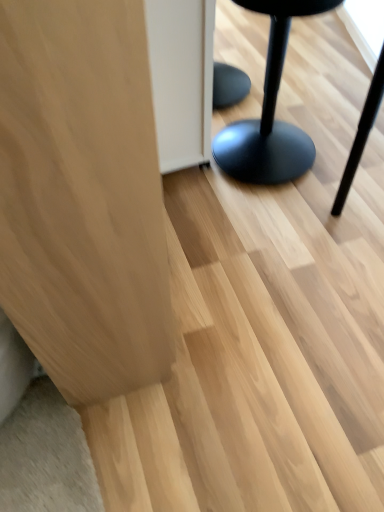
Question: Can you confirm if light wood cabinet at left, positioned as the second furniture in right-to-left order, is wider than matte black stool at right, the 2th furniture when ordered from left to right?

Choices:
 (A) yes
 (B) no

Answer: (A)

Question: Is light wood cabinet at left, positioned as the second furniture in right-to-left order, located outside matte black stool at right, the 2th furniture when ordered from left to right?

Choices:
 (A) yes
 (B) no

Answer: (A)

Question: Is light wood cabinet at left, positioned as the second furniture in right-to-left order, at the right side of matte black stool at right, placed as the first furniture when sorted from right to left?

Choices:
 (A) no
 (B) yes

Answer: (A)

Question: Can you confirm if light wood cabinet at left, the 1th furniture from the left, is bigger than matte black stool at right, placed as the first furniture when sorted from right to left?

Choices:
 (A) no
 (B) yes

Answer: (B)

Question: Are light wood cabinet at left, positioned as the second furniture in right-to-left order, and matte black stool at right, the 2th furniture when ordered from left to right, far apart?

Choices:
 (A) yes
 (B) no

Answer: (A)

Question: Does light wood cabinet at left, the 1th furniture from the left, appear on the left side of matte black stool at right, placed as the first furniture when sorted from right to left?

Choices:
 (A) no
 (B) yes

Answer: (B)

Question: Can you confirm if matte black stool at right, placed as the first furniture when sorted from right to left, is positioned to the right of light wood cabinet at left, positioned as the second furniture in right-to-left order?

Choices:
 (A) yes
 (B) no

Answer: (A)

Question: Would you consider matte black stool at right, the 2th furniture when ordered from left to right, to be distant from light wood cabinet at left, positioned as the second furniture in right-to-left order?

Choices:
 (A) no
 (B) yes

Answer: (B)

Question: Does matte black stool at right, the 2th furniture when ordered from left to right, have a greater width compared to light wood cabinet at left, positioned as the second furniture in right-to-left order?

Choices:
 (A) no
 (B) yes

Answer: (A)

Question: From the image's perspective, is matte black stool at right, placed as the first furniture when sorted from right to left, under light wood cabinet at left, the 1th furniture from the left?

Choices:
 (A) no
 (B) yes

Answer: (A)

Question: Is matte black stool at right, the 2th furniture when ordered from left to right, oriented away from light wood cabinet at left, positioned as the second furniture in right-to-left order?

Choices:
 (A) yes
 (B) no

Answer: (B)

Question: From the image's perspective, is matte black stool at right, the 2th furniture when ordered from left to right, over light wood cabinet at left, positioned as the second furniture in right-to-left order?

Choices:
 (A) no
 (B) yes

Answer: (B)

Question: Based on their sizes in the image, would you say light wood cabinet at left, positioned as the second furniture in right-to-left order, is bigger or smaller than matte black stool at right, placed as the first furniture when sorted from right to left?

Choices:
 (A) big
 (B) small

Answer: (A)